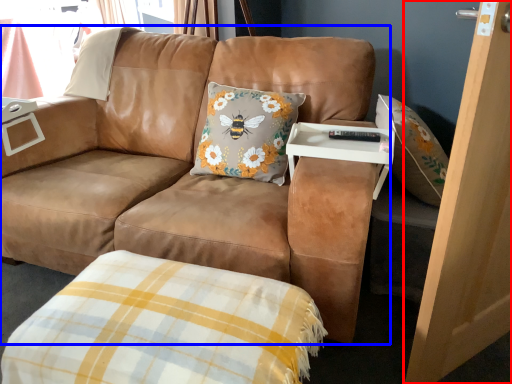
Question: Which object appears farthest to the camera in this image, screen door (highlighted by a red box) or studio couch (highlighted by a blue box)?

Choices:
 (A) screen door
 (B) studio couch

Answer: (B)